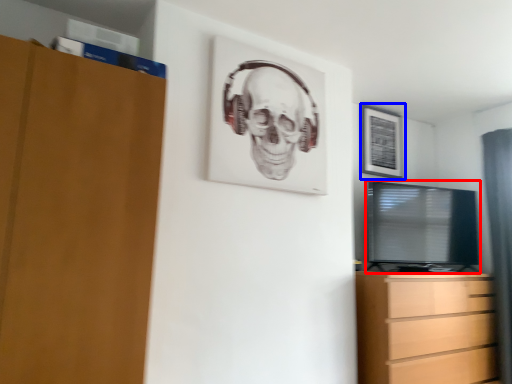
Question: Which of the following is the closest to the observer, television (highlighted by a red box) or picture frame (highlighted by a blue box)?

Choices:
 (A) television
 (B) picture frame

Answer: (A)